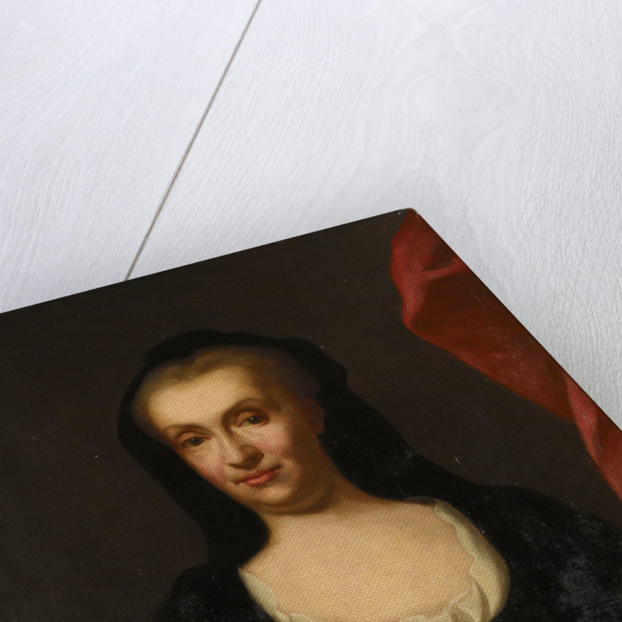
At what (x,y) coordinates should I click in order to perform the action: click on chest. Please return your answer as a coordinate pair (x, y). Looking at the image, I should click on (364, 567).